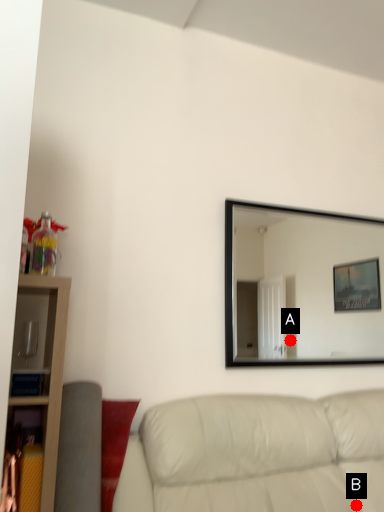
Question: Two points are circled on the image, labeled by A and B beside each circle. Which of the following is the closest to the observer?

Choices:
 (A) A is closer
 (B) B is closer

Answer: (B)